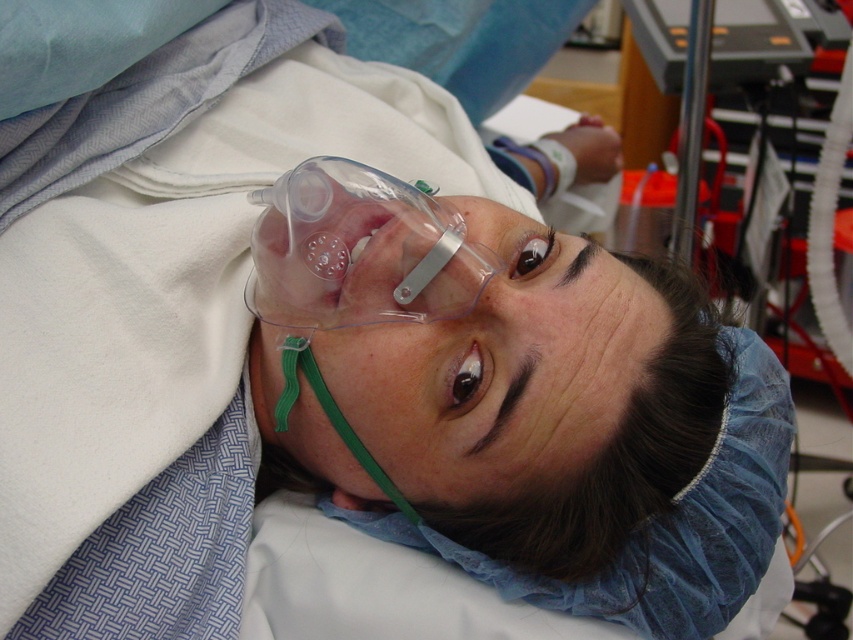
Question: Which point is closer to the camera?

Choices:
 (A) metallic silver oxygen tank at upper right
 (B) transparent plastic mask at center

Answer: (B)

Question: Can you confirm if transparent plastic mask at center is wider than metallic silver oxygen tank at upper right?

Choices:
 (A) no
 (B) yes

Answer: (A)

Question: Does transparent plastic mask at center appear over metallic silver oxygen tank at upper right?

Choices:
 (A) no
 (B) yes

Answer: (A)

Question: Is transparent plastic mask at center wider than metallic silver oxygen tank at upper right?

Choices:
 (A) no
 (B) yes

Answer: (A)

Question: Which point appears closest to the camera in this image?

Choices:
 (A) (286, 266)
 (B) (625, 202)

Answer: (A)